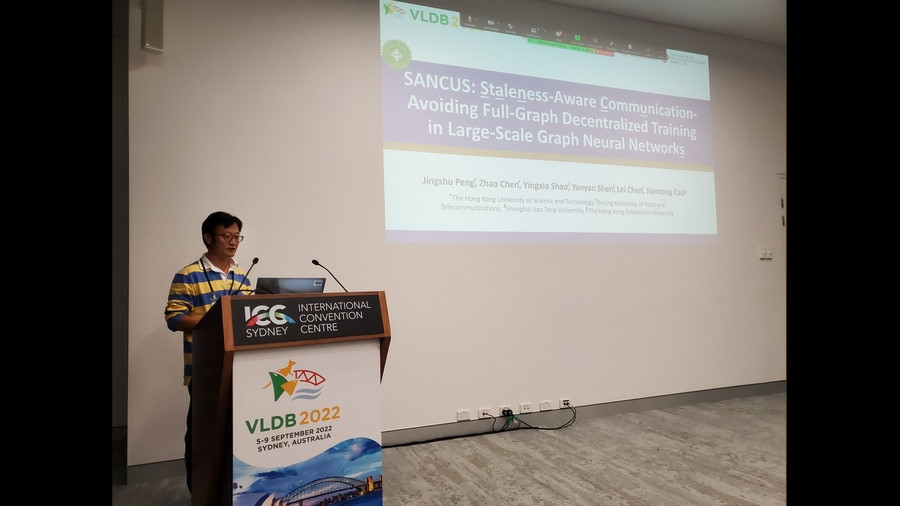
You are a GUI agent. You are given a task and a screenshot of the screen. Output one action in this format:
    pyautogui.click(x=<x>, y=<y>)
    Task: Click on the wall outlet
    This screenshot has width=900, height=506.
    Given the screenshot: What is the action you would take?
    pyautogui.click(x=460, y=413), pyautogui.click(x=487, y=413), pyautogui.click(x=505, y=410), pyautogui.click(x=525, y=410), pyautogui.click(x=541, y=408), pyautogui.click(x=562, y=402)